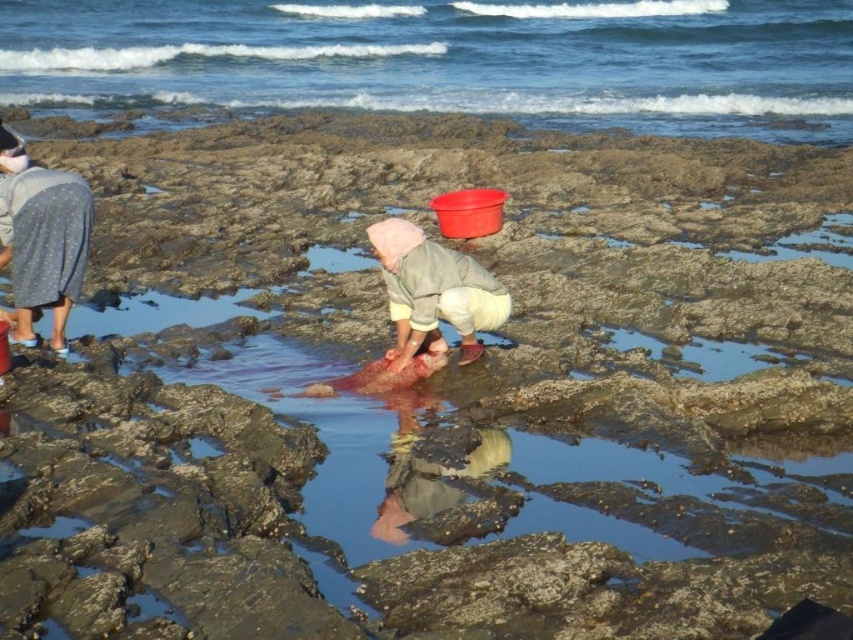
Question: Which of the following is the farthest from the observer?

Choices:
 (A) (425, 243)
 (B) (25, 248)

Answer: (B)

Question: Which is nearer to the gray dotted skirt at upper left?

Choices:
 (A) pink fabric at center
 (B) blue water at upper center

Answer: (A)

Question: From the image, what is the correct spatial relationship of gray dotted skirt at upper left in relation to pink fabric at center?

Choices:
 (A) right
 (B) left

Answer: (B)

Question: Does gray dotted skirt at upper left come in front of pink fabric at center?

Choices:
 (A) yes
 (B) no

Answer: (B)

Question: Can you confirm if gray dotted skirt at upper left is positioned to the right of pink fabric at center?

Choices:
 (A) no
 (B) yes

Answer: (A)

Question: Based on their relative distances, which object is farther from the blue water at upper center?

Choices:
 (A) gray dotted skirt at upper left
 (B) pink fabric at center

Answer: (B)